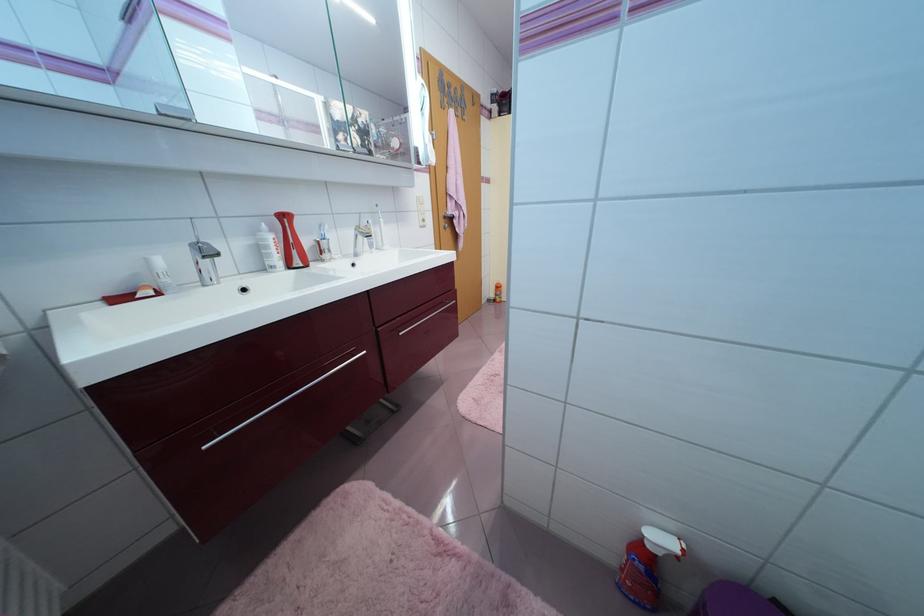
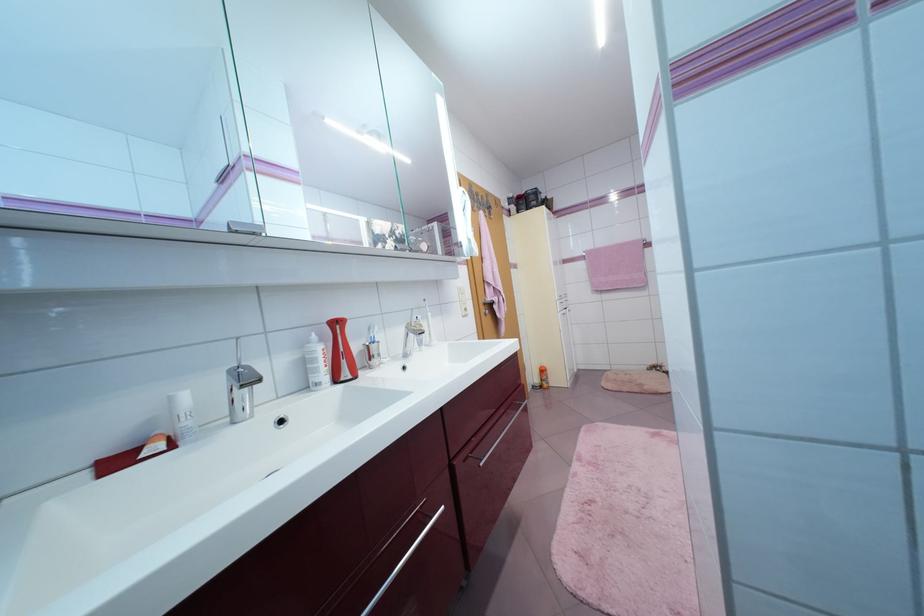
Consider the image. What movement of the cameraman would produce the second image?

The cameraman moved toward left, forward.